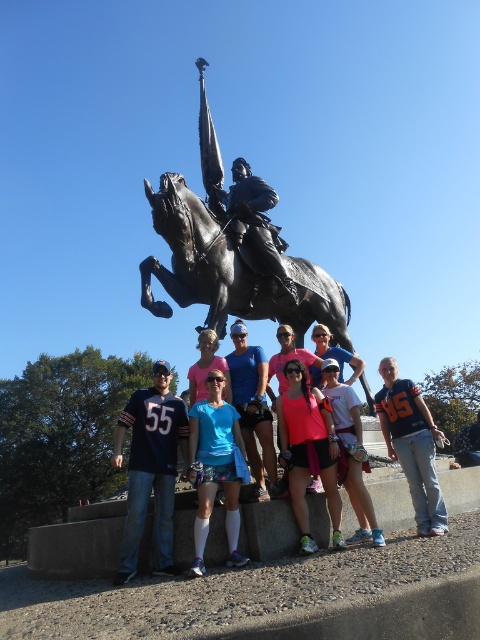
Question: Is blue jersey at center wider than blue fabric shorts at center?

Choices:
 (A) yes
 (B) no

Answer: (A)

Question: Estimate the real-world distances between objects in this image. Which object is farther from the blue jersey at center?

Choices:
 (A) blue fabric shorts at center
 (B) polished bronze statue at center

Answer: (B)

Question: Which is nearer to the blue jersey at center?

Choices:
 (A) polished bronze statue at center
 (B) blue fabric shorts at center
 (C) bronze/statue at center

Answer: (B)

Question: Is blue fabric shorts at center positioned in front of polished bronze statue at center?

Choices:
 (A) yes
 (B) no

Answer: (A)

Question: In this image, where is blue fabric shorts at center located relative to polished bronze statue at center?

Choices:
 (A) below
 (B) above

Answer: (A)

Question: Estimate the real-world distances between objects in this image. Which object is farther from the matte black jersey at center?

Choices:
 (A) blue jersey at center
 (B) polished bronze statue at center
 (C) blue fabric shorts at center

Answer: (B)